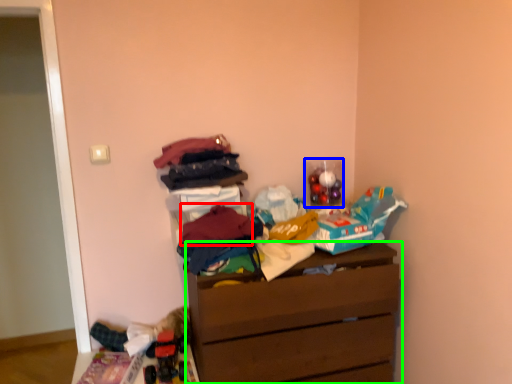
Question: Based on their relative distances, which object is nearer to clothing (highlighted by a red box)? Choose from toy (highlighted by a blue box) and chest of drawers (highlighted by a green box).

Choices:
 (A) toy
 (B) chest of drawers

Answer: (B)